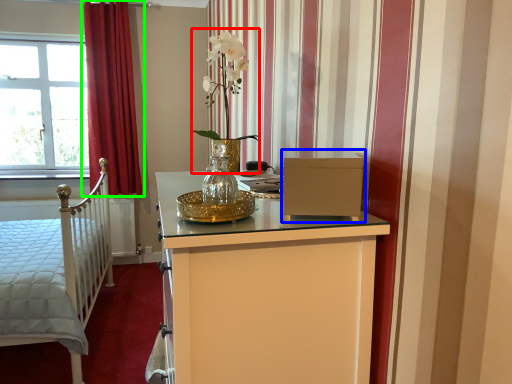
Question: Considering the real-world distances, which object is farthest from floral arrangement (highlighted by a red box)? file cabinet (highlighted by a blue box) or curtain (highlighted by a green box)?

Choices:
 (A) file cabinet
 (B) curtain

Answer: (B)